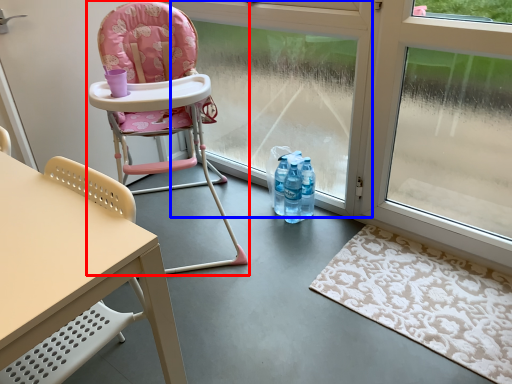
Question: Which object is further to the camera taking this photo, chair (highlighted by a red box) or window frame (highlighted by a blue box)?

Choices:
 (A) chair
 (B) window frame

Answer: (B)